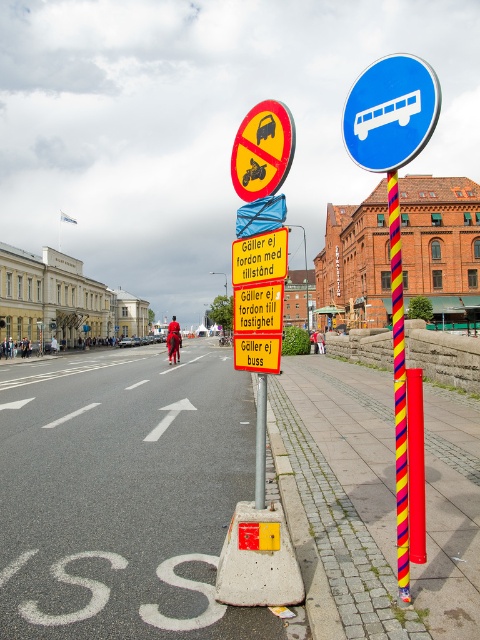
Does paved concrete sidewalk at lower center appear under multicolored striped pole at center?

Indeed, paved concrete sidewalk at lower center is positioned under multicolored striped pole at center.

Where is `paved concrete sidewalk at lower center`? Image resolution: width=480 pixels, height=640 pixels. paved concrete sidewalk at lower center is located at coordinates (123, 496).

Where is `paved concrete sidewalk at lower center`? This screenshot has height=640, width=480. paved concrete sidewalk at lower center is located at coordinates (123, 496).

Which is below, blue plastic bus at upper center or multicolored striped pole at center?

multicolored striped pole at center is below.

Is blue plastic bus at upper center bigger than multicolored striped pole at center?

No, blue plastic bus at upper center is not bigger than multicolored striped pole at center.

Which is in front, point (403, 163) or point (392, 195)?

Point (403, 163) is in front.

Locate an element on the screen. This screenshot has width=480, height=640. blue plastic bus at upper center is located at coordinates (391, 113).

Is the position of paved concrete sidewalk at lower center less distant than that of blue plastic bus at upper center?

That is False.

Which of these two, paved concrete sidewalk at lower center or blue plastic bus at upper center, stands shorter?

Standing shorter between the two is paved concrete sidewalk at lower center.

The height and width of the screenshot is (640, 480). What are the coordinates of `paved concrete sidewalk at lower center` in the screenshot? It's located at pos(123,496).